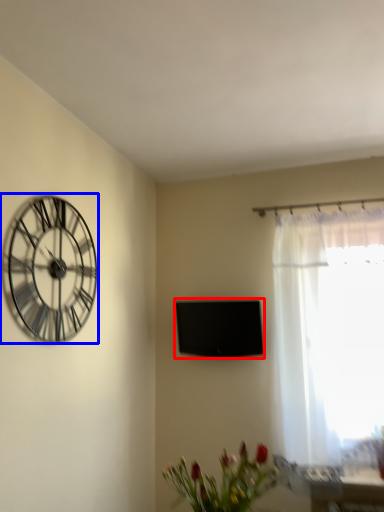
Question: Which of the following is the closest to the observer, window screen (highlighted by a red box) or wall clock (highlighted by a blue box)?

Choices:
 (A) window screen
 (B) wall clock

Answer: (B)